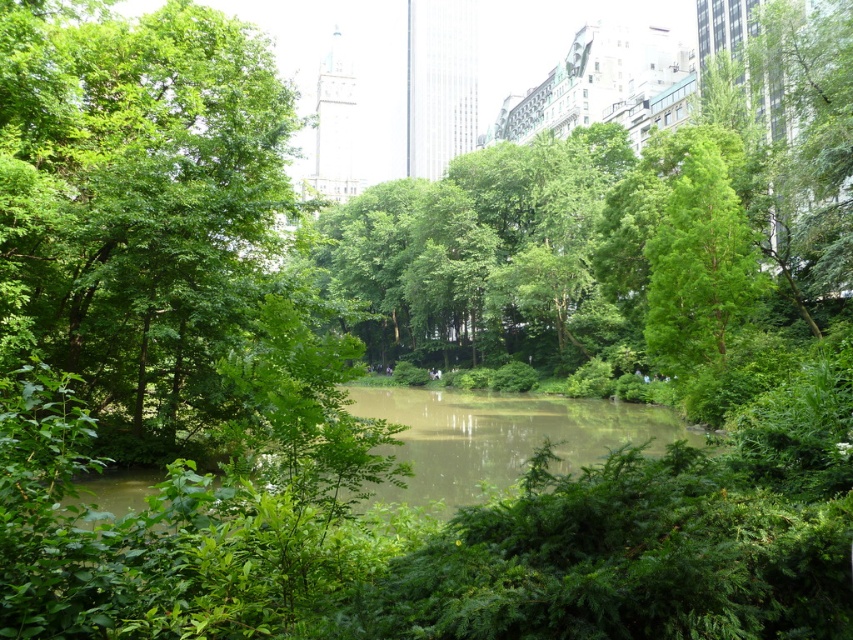
Does point (103, 200) come farther from viewer compared to point (717, 225)?

No, it is not.

Looking at this image, between green leafy tree at center and green leafy tree at upper right, which one appears on the right side from the viewer's perspective?

green leafy tree at upper right

Image resolution: width=853 pixels, height=640 pixels. What do you see at coordinates (137, 204) in the screenshot? I see `green leafy tree at center` at bounding box center [137, 204].

Where is `green leafy tree at center`? The width and height of the screenshot is (853, 640). green leafy tree at center is located at coordinates (137, 204).